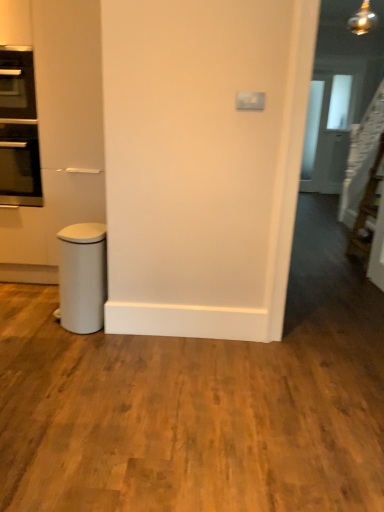
Question: From a real-world perspective, is white matte waste bin at lower left positioned under transparent glass door at upper right based on gravity?

Choices:
 (A) yes
 (B) no

Answer: (A)

Question: Is white matte waste bin at lower left to the right of transparent glass door at upper right from the viewer's perspective?

Choices:
 (A) no
 (B) yes

Answer: (A)

Question: Is white matte waste bin at lower left looking in the opposite direction of transparent glass door at upper right?

Choices:
 (A) no
 (B) yes

Answer: (A)

Question: Is the position of white matte waste bin at lower left less distant than that of transparent glass door at upper right?

Choices:
 (A) yes
 (B) no

Answer: (A)

Question: Is the position of white matte waste bin at lower left more distant than that of transparent glass door at upper right?

Choices:
 (A) no
 (B) yes

Answer: (A)

Question: From a real-world perspective, is white matte waste bin at lower left physically located above or below black glass oven at left?

Choices:
 (A) above
 (B) below

Answer: (B)

Question: Considering the positions of point (79, 272) and point (6, 113), is point (79, 272) closer or farther from the camera than point (6, 113)?

Choices:
 (A) closer
 (B) farther

Answer: (A)

Question: Considering the relative positions of white matte waste bin at lower left and black glass oven at left in the image provided, is white matte waste bin at lower left to the left or to the right of black glass oven at left?

Choices:
 (A) left
 (B) right

Answer: (B)

Question: Considering the positions of white matte waste bin at lower left and black glass oven at left in the image, is white matte waste bin at lower left taller or shorter than black glass oven at left?

Choices:
 (A) tall
 (B) short

Answer: (A)

Question: Relative to transparent glass door at upper right, is white matte waste bin at lower left in front or behind?

Choices:
 (A) front
 (B) behind

Answer: (A)

Question: From a real-world perspective, relative to transparent glass door at upper right, is white matte waste bin at lower left vertically above or below?

Choices:
 (A) below
 (B) above

Answer: (A)

Question: Considering the positions of white matte waste bin at lower left and transparent glass door at upper right in the image, is white matte waste bin at lower left wider or thinner than transparent glass door at upper right?

Choices:
 (A) wide
 (B) thin

Answer: (A)

Question: In terms of height, does white matte waste bin at lower left look taller or shorter compared to transparent glass door at upper right?

Choices:
 (A) short
 (B) tall

Answer: (A)

Question: Is point (324, 96) closer or farther from the camera than point (69, 244)?

Choices:
 (A) closer
 (B) farther

Answer: (B)

Question: Relative to white matte waste bin at lower left, is transparent glass door at upper right in front or behind?

Choices:
 (A) behind
 (B) front

Answer: (A)